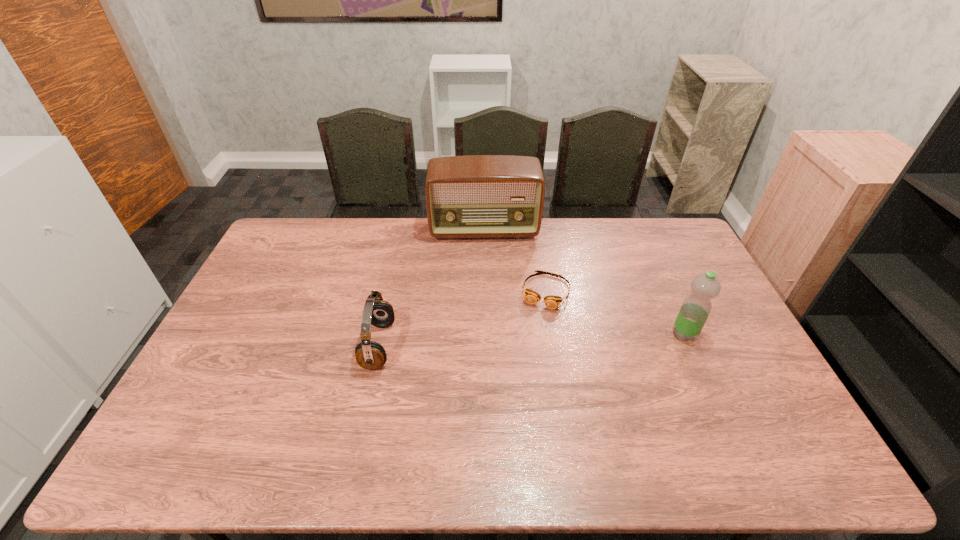
The width and height of the screenshot is (960, 540). I want to click on free space at the near edge of the desktop, so click(x=670, y=427).

The width and height of the screenshot is (960, 540). What are the coordinates of `vacant space at the left edge of the desktop` in the screenshot? It's located at (261, 340).

Identify the location of free region at the right edge of the desktop. (660, 273).

You are a GUI agent. You are given a task and a screenshot of the screen. Output one action in this format:
    pyautogui.click(x=<x>, y=<y>)
    Task: Click on the unoccupied position between the water bottle and the farthest object
    
    Given the screenshot: What is the action you would take?
    pyautogui.click(x=585, y=282)

Locate an element on the screen. vacant space in between the shortest object and the headset is located at coordinates (463, 319).

Where is `free space between the second tallest object and the shortest object`? This screenshot has height=540, width=960. free space between the second tallest object and the shortest object is located at coordinates point(615,313).

Where is `vacant area that lies between the rightmost object and the radio receiver`? The height and width of the screenshot is (540, 960). vacant area that lies between the rightmost object and the radio receiver is located at coordinates (585, 282).

You are a GUI agent. You are given a task and a screenshot of the screen. Output one action in this format:
    pyautogui.click(x=<x>, y=<y>)
    Task: Click on the blank region between the water bottle and the radio receiver
    
    Given the screenshot: What is the action you would take?
    pyautogui.click(x=585, y=282)

This screenshot has width=960, height=540. I want to click on empty space that is in between the third tallest object and the shortest object, so click(463, 319).

I want to click on vacant space that is in between the rightmost object and the radio receiver, so click(x=585, y=282).